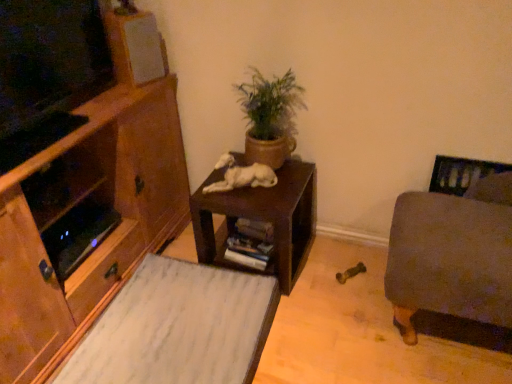
Where is `white matte speaker at upper left`? The height and width of the screenshot is (384, 512). white matte speaker at upper left is located at coordinates (135, 47).

What do you see at coordinates (135, 47) in the screenshot?
I see `white matte speaker at upper left` at bounding box center [135, 47].

In order to face dark brown wood table at center, should I rotate leftwards or rightwards?

A 0.259 degree turn to the right will do.

This screenshot has width=512, height=384. What do you see at coordinates (241, 175) in the screenshot?
I see `white fur dog at center` at bounding box center [241, 175].

The image size is (512, 384). I want to click on velvet gray ottoman at right, so click(x=452, y=255).

Is white matte speaker at upper left completely or partially outside of dark brown wood table at center?

Yes, white matte speaker at upper left is not within dark brown wood table at center.

Is white matte speaker at upper left touching dark brown wood table at center?

No, white matte speaker at upper left is not with dark brown wood table at center.

Locate an element on the screen. speaker above the dark brown wood table at center (from the image's perspective) is located at coordinates (135, 47).

From the image's perspective, which is above, green matte plant pot at center or wooden cabinet at left?

green matte plant pot at center appears higher in the image.

Looking at this image, which point is more forward, [237,89] or [118,93]?

The point [118,93] is closer to the camera.

Does green matte plant pot at center appear on the left side of wooden cabinet at left?

Incorrect, green matte plant pot at center is not on the left side of wooden cabinet at left.

From a real-world perspective, which is physically below, green matte plant pot at center or wooden cabinet at left?

wooden cabinet at left is physically lower.

Is white fur dog at center to the left of velvet gray ottoman at right from the viewer's perspective?

Indeed, white fur dog at center is positioned on the left side of velvet gray ottoman at right.

Could you tell me if white fur dog at center is turned towards velvet gray ottoman at right?

No.

Considering the sizes of objects white fur dog at center and velvet gray ottoman at right in the image provided, who is taller, white fur dog at center or velvet gray ottoman at right?

With more height is velvet gray ottoman at right.

Is white fur dog at center far from velvet gray ottoman at right?

white fur dog at center is actually quite close to velvet gray ottoman at right.

Is the surface of velvet gray ottoman at right in direct contact with wooden drawer at lower left?

There is a gap between velvet gray ottoman at right and wooden drawer at lower left.

Is velvet gray ottoman at right oriented away from wooden drawer at lower left?

No, velvet gray ottoman at right is not facing away from wooden drawer at lower left.

Is the position of velvet gray ottoman at right more distant than that of wooden drawer at lower left?

No, velvet gray ottoman at right is closer to the viewer.

How much distance is there between velvet gray ottoman at right and wooden drawer at lower left?

velvet gray ottoman at right is 27.58 inches from wooden drawer at lower left.

From a real-world perspective, does white fur dog at center sit lower than wooden drawer at lower left?

No.

Is wooden drawer at lower left at the back of white fur dog at center?

No.

Is point (250, 183) in front of point (181, 352)?

That is False.

Is white fur dog at center wider or thinner than wooden drawer at lower left?

In the image, white fur dog at center appears to be more narrow than wooden drawer at lower left.

From a real-world perspective, is velvet gray ottoman at right positioned over dark brown wood table at center based on gravity?

Yes, from a real-world perspective, velvet gray ottoman at right is on top of dark brown wood table at center.

This screenshot has width=512, height=384. Identify the location of table that appears behind the velvet gray ottoman at right. (x=262, y=218).

Is velvet gray ottoman at right oriented towards dark brown wood table at center?

No, velvet gray ottoman at right is not facing towards dark brown wood table at center.

Does point (494, 193) come behind point (194, 208)?

No, (494, 193) is in front of (194, 208).

Is dark brown wood table at center aimed at wooden cabinet at left?

No, dark brown wood table at center does not turn towards wooden cabinet at left.

Who is more distant, dark brown wood table at center or wooden cabinet at left?

dark brown wood table at center is further away from the camera.

From the image's perspective, is dark brown wood table at center under wooden cabinet at left?

Yes, from the image's perspective, dark brown wood table at center is beneath wooden cabinet at left.

Is dark brown wood table at center bigger than wooden cabinet at left?

Actually, dark brown wood table at center might be smaller than wooden cabinet at left.

This screenshot has width=512, height=384. Identify the location of table on the right of white matte speaker at upper left. tap(262, 218).

The width and height of the screenshot is (512, 384). I want to click on cabinetry below the green matte plant pot at center (from the image's perspective), so (x=79, y=169).

Based on their spatial positions, is white matte speaker at upper left or wooden cabinet at left closer to white fur dog at center?

Among the two, wooden cabinet at left is located nearer to white fur dog at center.

Looking at the image, which one is located closer to wooden drawer at lower left, white matte speaker at upper left or wooden cabinet at left?

The object closer to wooden drawer at lower left is wooden cabinet at left.

Estimate the real-world distances between objects in this image. Which object is further from white fur dog at center, green matte plant pot at center or white matte speaker at upper left?

white matte speaker at upper left lies further to white fur dog at center than the other object.

When comparing their distances from velvet gray ottoman at right, does green matte plant pot at center or wooden drawer at lower left seem further?

wooden drawer at lower left is positioned further to the anchor velvet gray ottoman at right.

Estimate the real-world distances between objects in this image. Which object is closer to wooden cabinet at left, white fur dog at center or white matte speaker at upper left?

white matte speaker at upper left is positioned closer to the anchor wooden cabinet at left.

Looking at this image, based on their spatial positions, is white fur dog at center or white matte speaker at upper left closer to wooden drawer at lower left?

Among the two, white fur dog at center is located nearer to wooden drawer at lower left.

Estimate the real-world distances between objects in this image. Which object is closer to white matte speaker at upper left, wooden cabinet at left or green matte plant pot at center?

wooden cabinet at left.

Considering their positions, is white fur dog at center positioned closer to green matte plant pot at center than white matte speaker at upper left?

white fur dog at center is closer to green matte plant pot at center.

Identify the location of table located between white matte speaker at upper left and velvet gray ottoman at right in the left-right direction. The image size is (512, 384). (262, 218).

Find the location of a particular element. This screenshot has width=512, height=384. speaker positioned between wooden cabinet at left and white fur dog at center from near to far is located at coordinates (135, 47).

This screenshot has height=384, width=512. In order to click on plain situated between white matte speaker at upper left and velvet gray ottoman at right from left to right in this screenshot , I will do `click(178, 328)`.

This screenshot has height=384, width=512. Find the location of `plain between wooden cabinet at left and dark brown wood table at center from left to right`. plain between wooden cabinet at left and dark brown wood table at center from left to right is located at coordinates (178, 328).